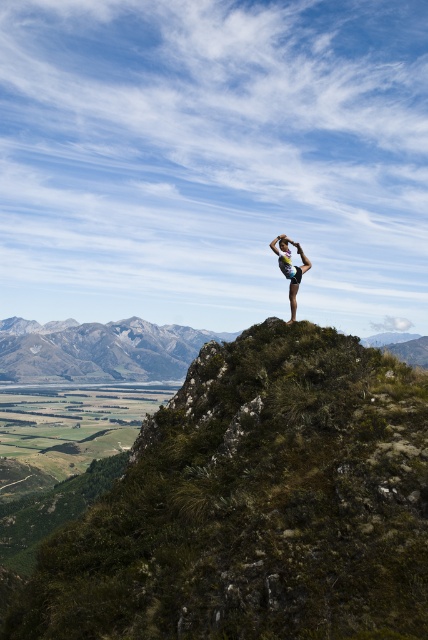
Between green grassy hillside at center and matte skin person at center, which one is positioned higher?

matte skin person at center

Is green grassy hillside at center taller than matte skin person at center?

Correct, green grassy hillside at center is much taller as matte skin person at center.

Between point (103, 528) and point (276, 241), which one is positioned behind?

The point (276, 241) is more distant.

Where is `green grassy hillside at center`? The width and height of the screenshot is (428, 640). green grassy hillside at center is located at coordinates (255, 506).

Does green grassy mountain at center appear over matte skin person at center?

Actually, green grassy mountain at center is below matte skin person at center.

From the picture: Does green grassy mountain at center have a larger size compared to matte skin person at center?

A: Yes, green grassy mountain at center is bigger than matte skin person at center.

Which is in front, point (6, 320) or point (291, 241)?

Positioned in front is point (291, 241).

This screenshot has height=640, width=428. I want to click on green grassy mountain at center, so click(x=98, y=348).

Is green grassy hillside at center bigger than green grassy mountain at center?

No.

Who is more forward, (240, 364) or (143, 365)?

Point (240, 364) is in front.

At what (x,y) coordinates should I click in order to perform the action: click on green grassy hillside at center. Please return your answer as a coordinate pair (x, y). Image resolution: width=428 pixels, height=640 pixels. Looking at the image, I should click on (255, 506).